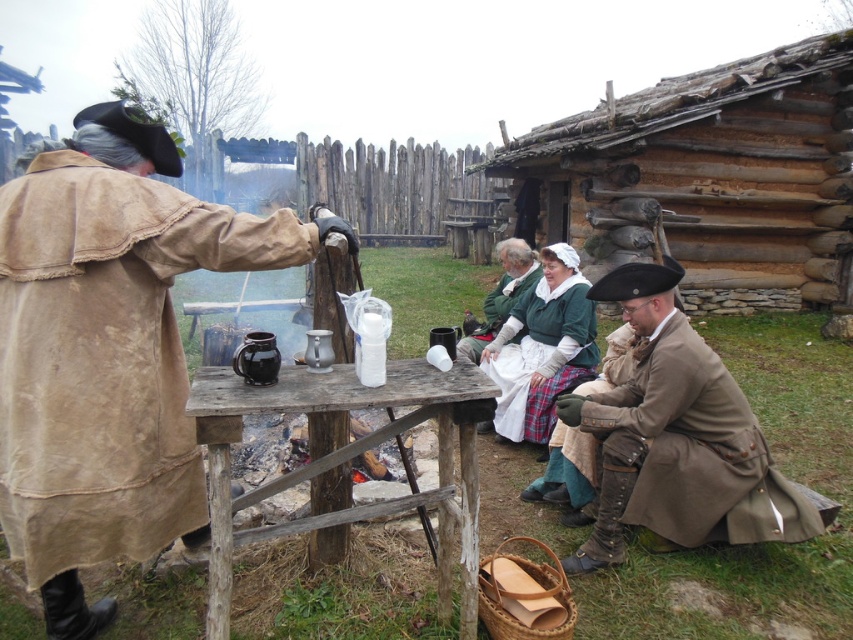
You are a participant in the historical reenactment and need to choose between the white cotton apron at center and the green woolen robe at center. Which garment has a larger width?

The white cotton apron at center might be wider than green woolen robe at center, so the white cotton apron at center could be the wider option.

You are a visitor at this historical reenactment and see both the beige suede robe at left and the brown leather robe at lower right. Which robe is located to the east of the other?

The beige suede robe at left is positioned on the left side of brown leather robe at lower right, so the beige suede robe at left is to the east of the brown leather robe at lower right.

You are a visitor at the historical reenactment and want to place a small item on the wooden table at center without disturbing the brown leather robe at lower right. Is there enough space on the table?

The brown leather robe at lower right is below the wooden table at center, so there is sufficient space on the table to place the item without disturbing the robe.